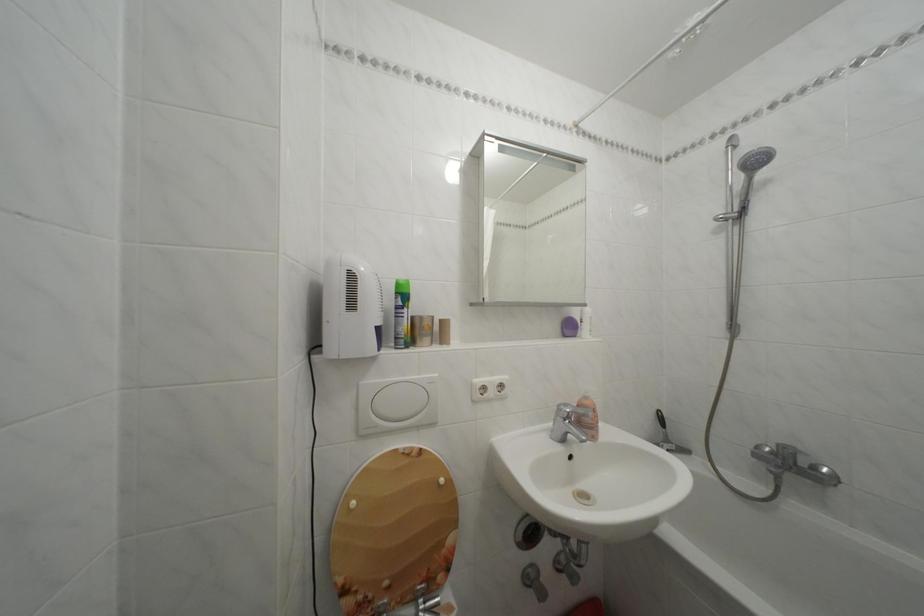
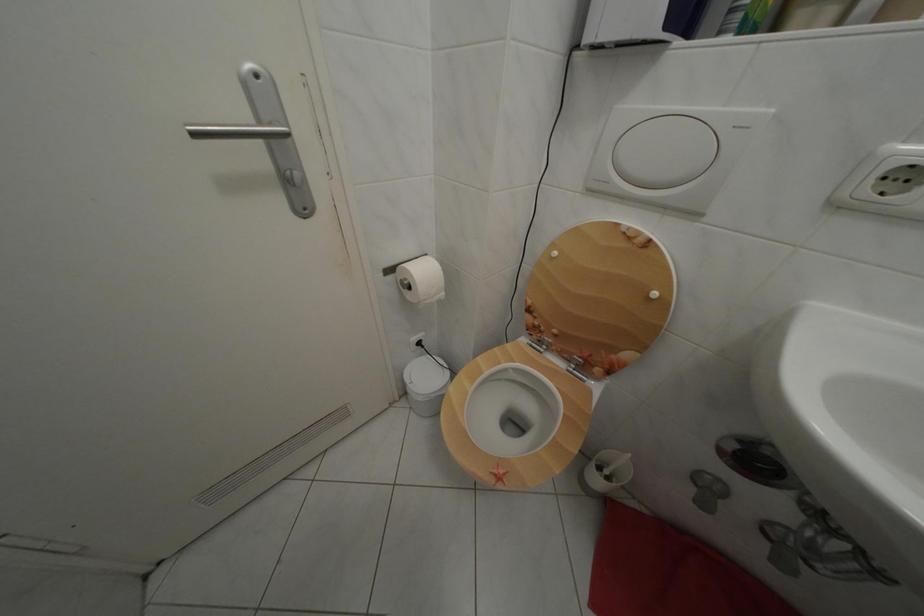
First-person continuous shooting, in which direction is the camera rotating?

The camera rotated toward left-down.